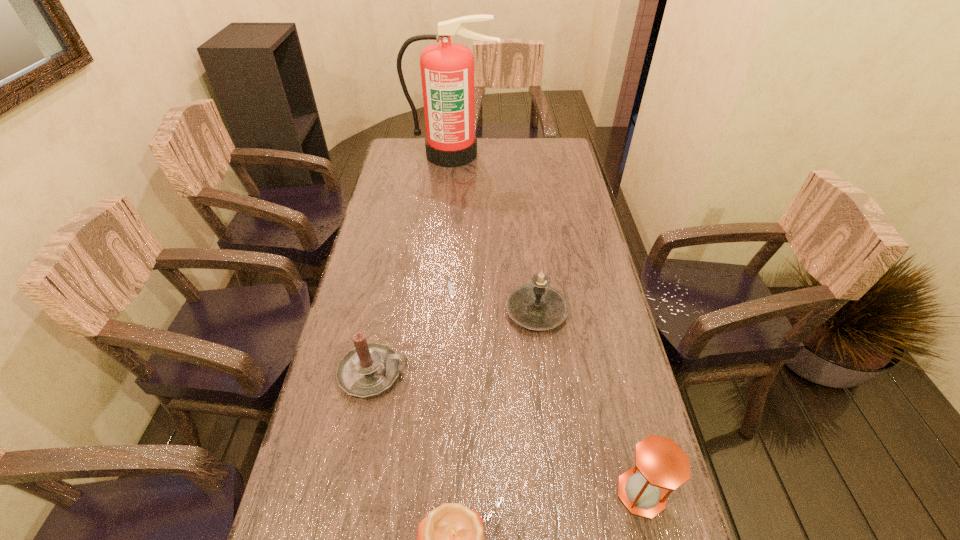
What are the coordinates of `free space that is in between the tallest object and the second object from right to left` in the screenshot? It's located at (494, 233).

At what (x,y) coordinates should I click in order to perform the action: click on unoccupied position between the leftmost candle and the rightmost object. Please return your answer as a coordinate pair (x, y). The image size is (960, 540). Looking at the image, I should click on (508, 433).

Where is `empty space between the second nearest candle and the fourth nearest object`? The height and width of the screenshot is (540, 960). empty space between the second nearest candle and the fourth nearest object is located at coordinates (455, 342).

In order to click on free space that is in between the farthest object and the leftmost candle in this screenshot , I will do `click(413, 264)`.

At what (x,y) coordinates should I click in order to perform the action: click on unoccupied area between the second farthest candle and the fourth nearest object. Please return your answer as a coordinate pair (x, y). The image size is (960, 540). Looking at the image, I should click on (455, 342).

Where is `free area in between the fourth nearest object and the third farthest object`? The height and width of the screenshot is (540, 960). free area in between the fourth nearest object and the third farthest object is located at coordinates (455, 342).

What are the coordinates of `empty space between the rightmost candle and the farthest object` in the screenshot? It's located at (494, 233).

Identify which object is the closest to the tallest object. Please provide its 2D coordinates. Your answer should be formatted as a tuple, i.e. [(x, y)], where the tuple contains the x and y coordinates of a point satisfying the conditions above.

[(537, 306)]

What are the coordinates of `object that is the second closest to the nearest candle` in the screenshot? It's located at (660, 464).

You are a GUI agent. You are given a task and a screenshot of the screen. Output one action in this format:
    pyautogui.click(x=<x>, y=<y>)
    Task: Click on the closest candle to the leftmost candle
    The width and height of the screenshot is (960, 540).
    Given the screenshot: What is the action you would take?
    pyautogui.click(x=450, y=539)